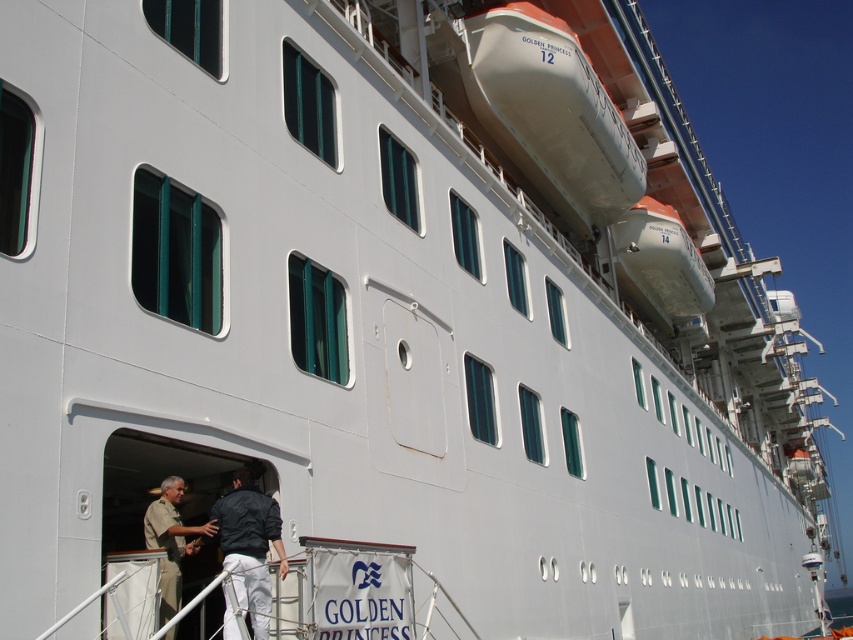
In the scene shown: You are standing on the deck of the Golden Princess cruise ship and notice two points marked on the ship wall. The first point is at coordinates point (x=253, y=515) and the second is at point (x=151, y=508). Which of these two points is nearer to your current position?

Point (x=253, y=515) is closer to the camera than point (x=151, y=508), so the first point is nearer to your current position.

You are a photographer standing on the dock next to the Golden Princess cruise ship. You want to take a photo of both the dark blue fabric jacket at lower left and the khaki uniform at lower left. Can you fit both subjects in the frame if your camera has a maximum field of view of 28 inches?

The distance between the dark blue fabric jacket at lower left and the khaki uniform at lower left is 27.29 inches. Since the camera can capture up to 28 inches, both subjects will fit within the frame.

You are standing on the dock next to the Golden Princess cruise ship and notice two people near the entrance. One is wearing a dark blue fabric jacket at lower left, and the other is in a khaki uniform at lower left. From your vantage point, which clothing item appears higher up?

The dark blue fabric jacket at lower left is located above the khaki uniform at lower left, so it appears higher up from your position on the dock.